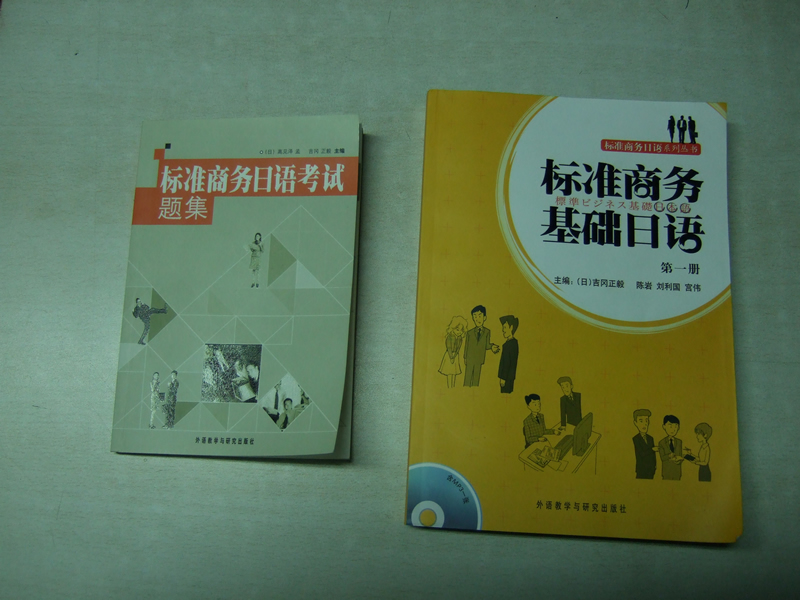
Where is `book on the right`? This screenshot has width=800, height=600. book on the right is located at coordinates (474, 269).